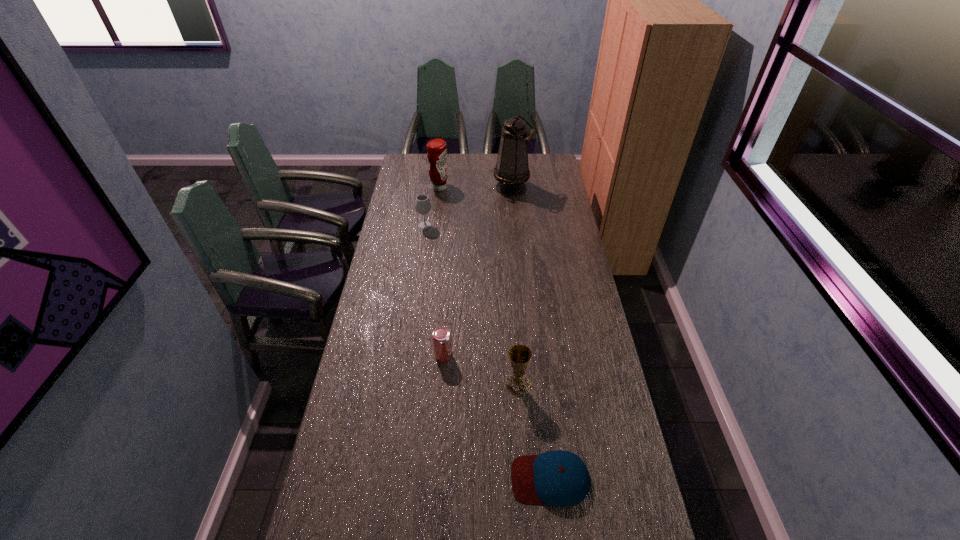
This screenshot has height=540, width=960. I want to click on free spot between the third farthest object and the condiment, so click(x=432, y=207).

This screenshot has height=540, width=960. I want to click on empty space that is in between the third object from left to right and the shortest object, so click(x=496, y=417).

This screenshot has width=960, height=540. What are the coordinates of `object that is the third closest to the fifth shortest object` in the screenshot? It's located at pos(441,337).

Find the location of a particular element. object that is the third closest to the baseball cap is located at coordinates (422, 204).

This screenshot has height=540, width=960. I want to click on free region that satisfies the following two spatial constraints: 1. on the front side of the second shortest object; 2. on the right side of the fifth shortest object, so click(x=420, y=355).

Find the location of a particular element. The height and width of the screenshot is (540, 960). vacant position in the image that satisfies the following two spatial constraints: 1. on the back side of the tallest object; 2. on the left side of the chalice is located at coordinates (504, 188).